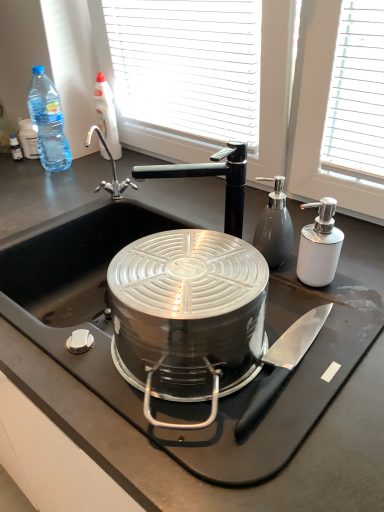
Locate an element on the screen. This screenshot has height=512, width=384. space that is in front of white glossy soap dispenser at right is located at coordinates (327, 334).